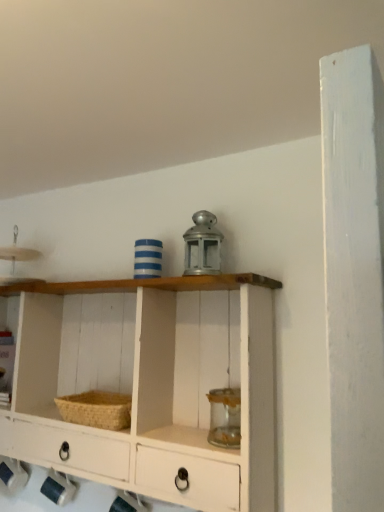
Question: Would you say white painted wood shelf at center is inside or outside woven straw basket at lower left?

Choices:
 (A) inside
 (B) outside

Answer: (B)

Question: Is white painted wood shelf at center in front of or behind woven straw basket at lower left in the image?

Choices:
 (A) front
 (B) behind

Answer: (A)

Question: In terms of height, does white painted wood shelf at center look taller or shorter compared to woven straw basket at lower left?

Choices:
 (A) tall
 (B) short

Answer: (A)

Question: Relative to white painted wood shelf at center, is woven straw basket at lower left in front or behind?

Choices:
 (A) front
 (B) behind

Answer: (B)

Question: From a real-world perspective, is woven straw basket at lower left above or below white painted wood shelf at center?

Choices:
 (A) above
 (B) below

Answer: (B)

Question: Is woven straw basket at lower left wider or thinner than white painted wood shelf at center?

Choices:
 (A) wide
 (B) thin

Answer: (B)

Question: Based on their sizes in the image, would you say woven straw basket at lower left is bigger or smaller than white painted wood shelf at center?

Choices:
 (A) big
 (B) small

Answer: (B)